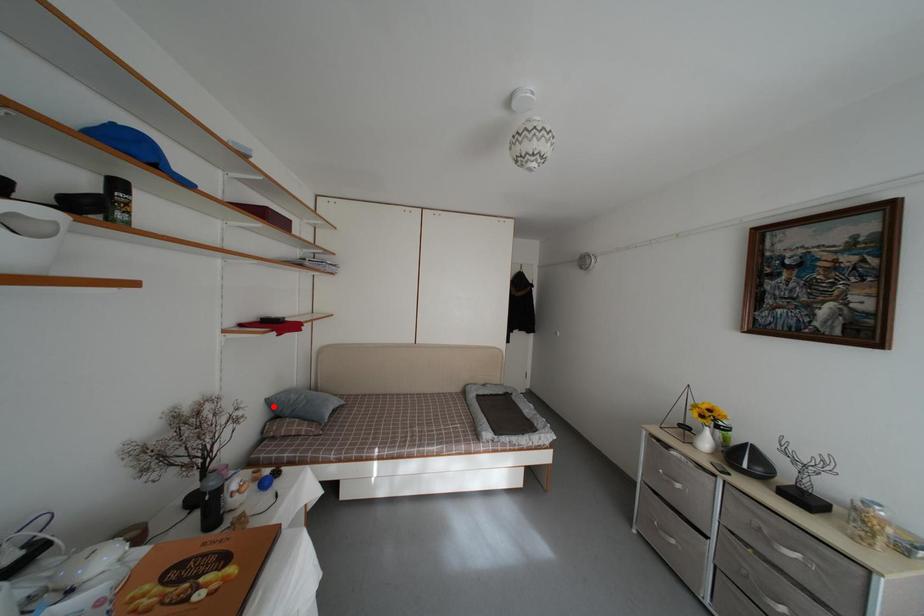
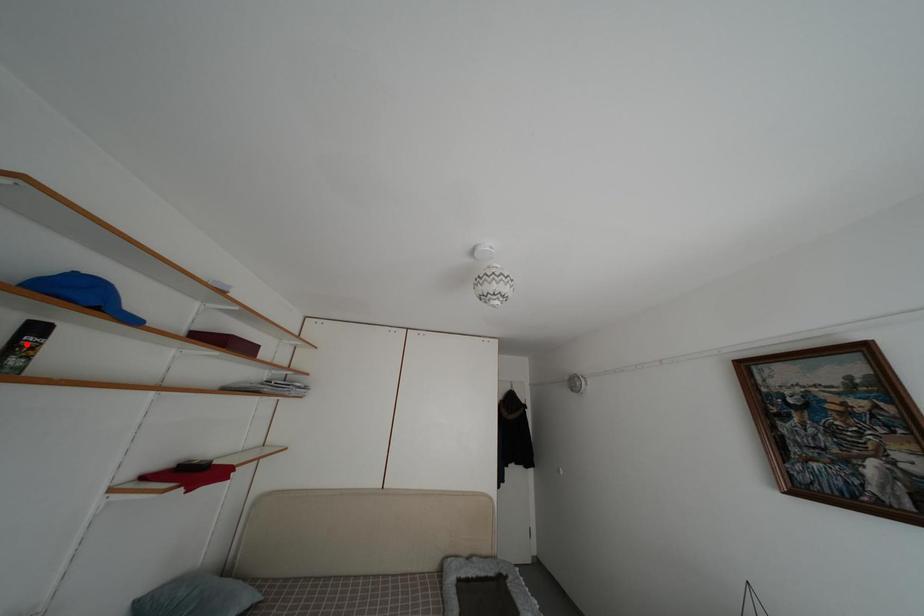
I am providing you with two images of the same scene from different viewpoints. A red point is marked on the first image and another point is marked on the second image. Does the point marked in image1 correspond to the same location as the one in image2?

No